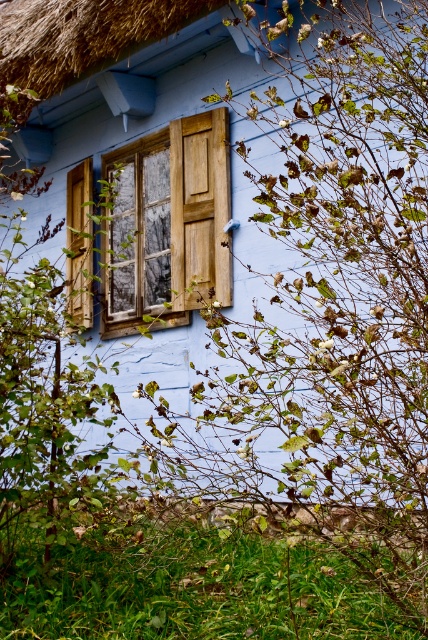
Is thatched straw roof at upper center taller than wooden at left?

Yes.

Can you confirm if thatched straw roof at upper center is wider than wooden at left?

Yes.

Who is more distant from viewer, (95, 0) or (86, 186)?

Positioned behind is point (86, 186).

Where is `thatched straw roof at upper center`? thatched straw roof at upper center is located at coordinates (82, 35).